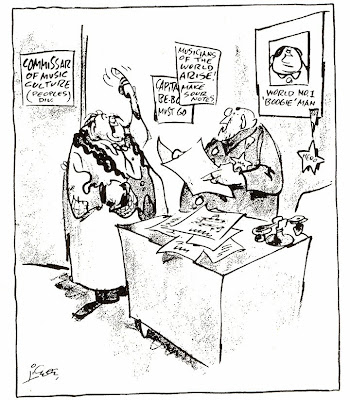
Where is `papers`? papers is located at coordinates (211, 231).